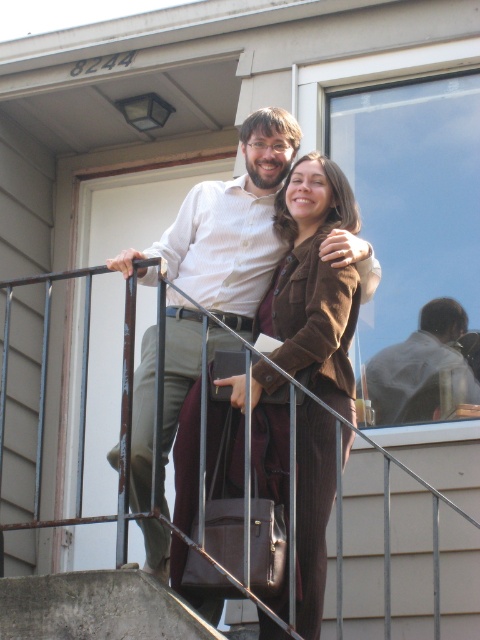
You are standing on the stairs outside the house and want to place a small potted plant between the two points marked as point (450, 540) and point (331, 468). Which point should the plant be closer to in order to be closer to the viewer?

The plant should be closer to point (450, 540) because it is further to the viewer than point (331, 468).

You are standing at the bottom of the stairs and want to reach the front door of the house. Which object, the metallic gray railing at upper center or the brown woolen suit at center, is closer to you as you approach the door?

The brown woolen suit at center is closer to you because the metallic gray railing at upper center is bigger, implying it is further away.